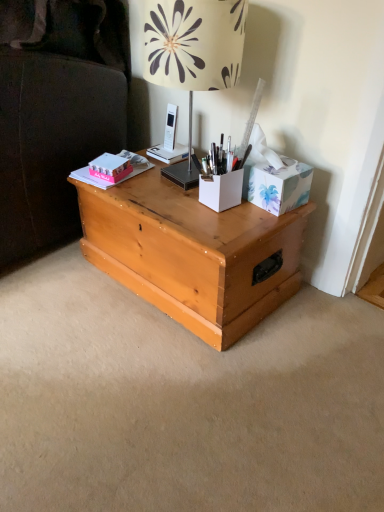
You are a GUI agent. You are given a task and a screenshot of the screen. Output one action in this format:
    pyautogui.click(x=<x>, y=<y>)
    Task: Click on the free point in front of pink matte book at upper left
    The image size is (384, 512).
    Given the screenshot: What is the action you would take?
    pyautogui.click(x=137, y=194)